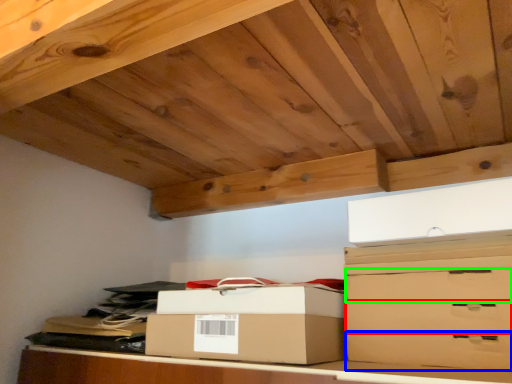
Question: Considering the real-world distances, which object is farthest from drawer (highlighted by a red box)? drawer (highlighted by a blue box) or drawer (highlighted by a green box)?

Choices:
 (A) drawer
 (B) drawer

Answer: (B)